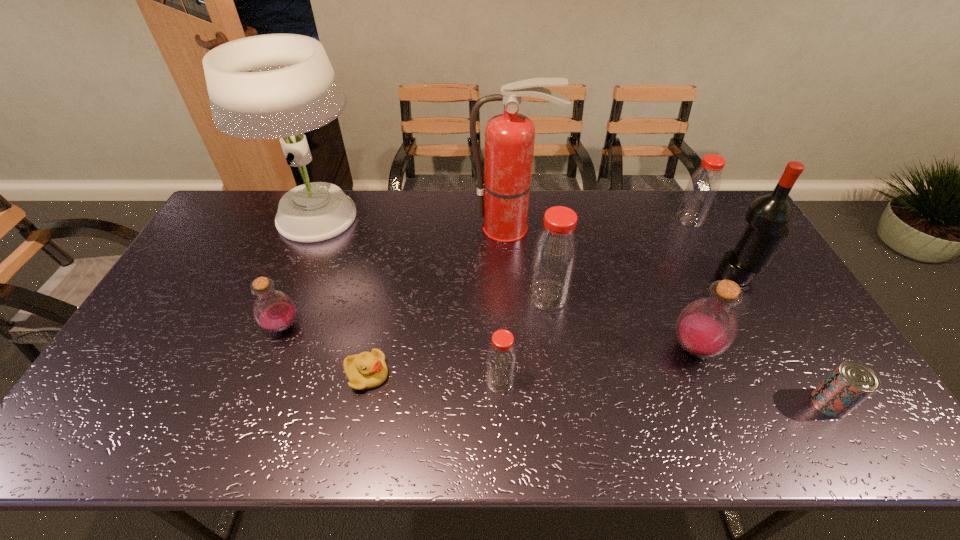
In order to click on free space at the right edge in this screenshot , I will do `click(815, 334)`.

Where is `free space at the far left corner of the desktop`? This screenshot has height=540, width=960. free space at the far left corner of the desktop is located at coordinates (225, 219).

This screenshot has width=960, height=540. I want to click on unoccupied area between the nearest red bottle and the fire extinguisher, so click(x=506, y=304).

At what (x,y) coordinates should I click in order to perform the action: click on vacant point located between the rightmost bottle and the bigger purple bottle. Please return your answer as a coordinate pair (x, y). The image size is (960, 540). Looking at the image, I should click on (692, 284).

The height and width of the screenshot is (540, 960). In order to click on vacant region between the second red bottle from right to left and the third tallest object in this screenshot , I will do `click(643, 285)`.

This screenshot has width=960, height=540. I want to click on vacant point located between the leftmost bottle and the third bottle from left to right, so click(x=416, y=311).

This screenshot has width=960, height=540. Identify the location of vacant area that lies between the leftmost red bottle and the shortest object. (434, 377).

Identify the location of empty space that is in between the shortest object and the white lamp. point(343,297).

You are a GUI agent. You are given a task and a screenshot of the screen. Output one action in this format:
    pyautogui.click(x=<x>, y=<y>)
    Task: Click on the empty space that is in between the eighth shortest object and the fire extinguisher
    The image size is (960, 540).
    Given the screenshot: What is the action you would take?
    pyautogui.click(x=625, y=251)

The width and height of the screenshot is (960, 540). Find the location of `vacant space that's between the red wine bottle and the yellow duckling`. vacant space that's between the red wine bottle and the yellow duckling is located at coordinates (552, 325).